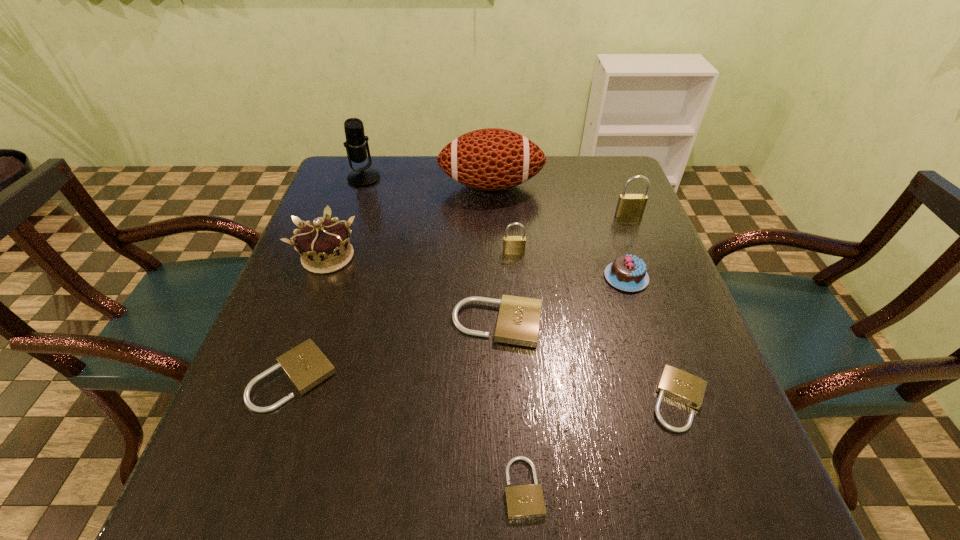
This screenshot has width=960, height=540. In order to click on the biggest beige padlock in this screenshot , I will do `click(518, 321)`.

Where is `the leftmost beige padlock`? The width and height of the screenshot is (960, 540). the leftmost beige padlock is located at coordinates (306, 366).

I want to click on the third shortest padlock, so click(306, 366).

What are the coordinates of `the fifth tallest padlock` in the screenshot? It's located at (681, 386).

In order to click on the second smallest beige padlock in this screenshot , I will do `click(681, 386)`.

Locate an element on the screen. the shortest object is located at coordinates (524, 501).

Image resolution: width=960 pixels, height=540 pixels. I want to click on the nearest object, so click(x=524, y=501).

The height and width of the screenshot is (540, 960). What are the coordinates of `blank space located 0.060m on the back of the microphone` in the screenshot? It's located at click(371, 159).

The image size is (960, 540). What are the coordinates of `vacant space located on the right of the football` in the screenshot? It's located at (616, 186).

This screenshot has height=540, width=960. Find the location of `vacant region located on the front-facing side of the bigger brass padlock`. vacant region located on the front-facing side of the bigger brass padlock is located at coordinates (637, 237).